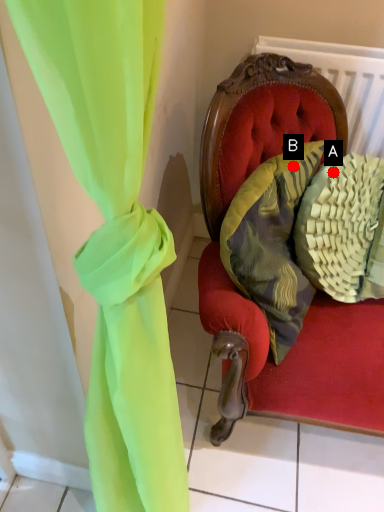
Question: Two points are circled on the image, labeled by A and B beside each circle. Which point appears farthest from the camera in this image?

Choices:
 (A) A is further
 (B) B is further

Answer: (A)